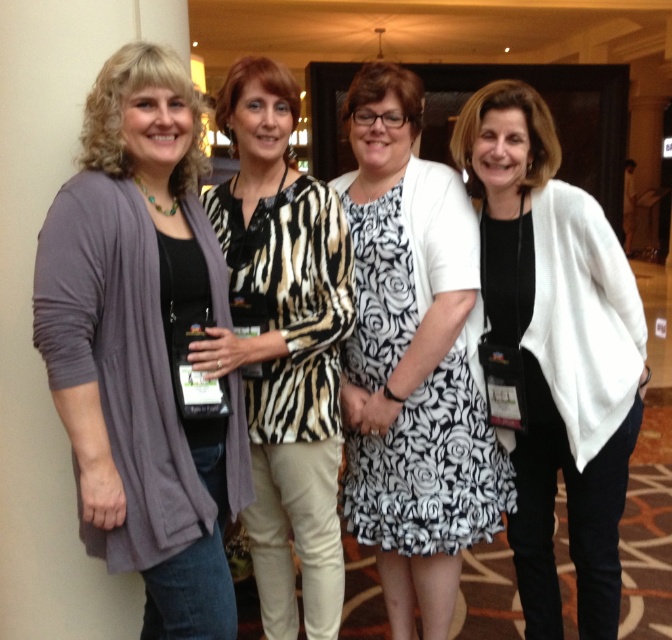
Based on the photo, you are organizing a fashion show and need to arrange the matte gray cardigan at left and the zebra print blouse at center based on their sizes. Which one should you place first if you want to start with the larger item?

The zebra print blouse at center is larger than the matte gray cardigan at left, so you should place the zebra print blouse at center first.

You are at a networking event and see two women wearing the matte gray cardigan at left and the zebra print blouse at center. Which one is standing to the left of the other?

The matte gray cardigan at left is positioned on the left side of the zebra print blouse at center, so the woman wearing the matte gray cardigan at left is standing to the left of the woman in the zebra print blouse at center.

How far apart are the two people standing closest to the point at coordinates point (476, 99)?

The two people closest to the point at coordinates point (476, 99) are 6.50 feet apart.